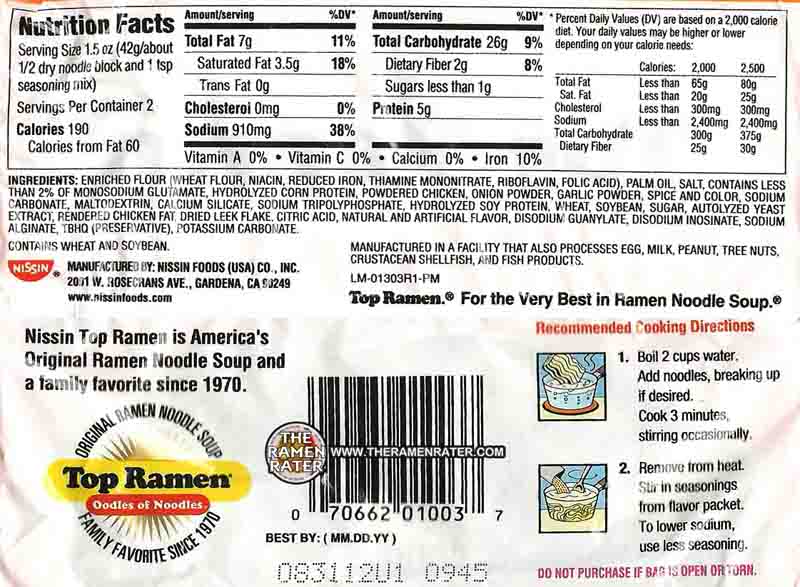
This screenshot has width=800, height=587. I want to click on soup bowl, so click(564, 400), click(573, 508).